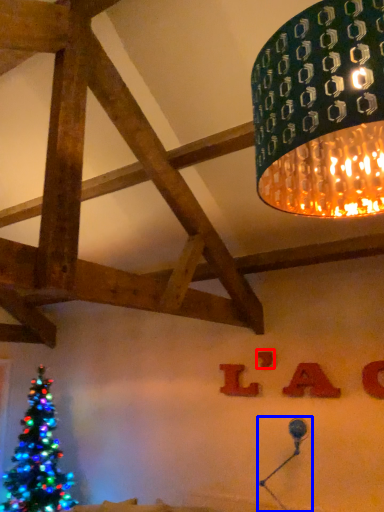
Question: Which point is further to the camera, letter (highlighted by a red box) or table lamp (highlighted by a blue box)?

Choices:
 (A) letter
 (B) table lamp

Answer: (A)